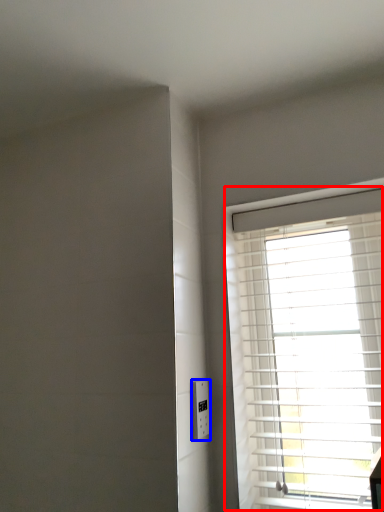
Question: Which point is further to the camera, window (highlighted by a red box) or electric outlet (highlighted by a blue box)?

Choices:
 (A) window
 (B) electric outlet

Answer: (B)